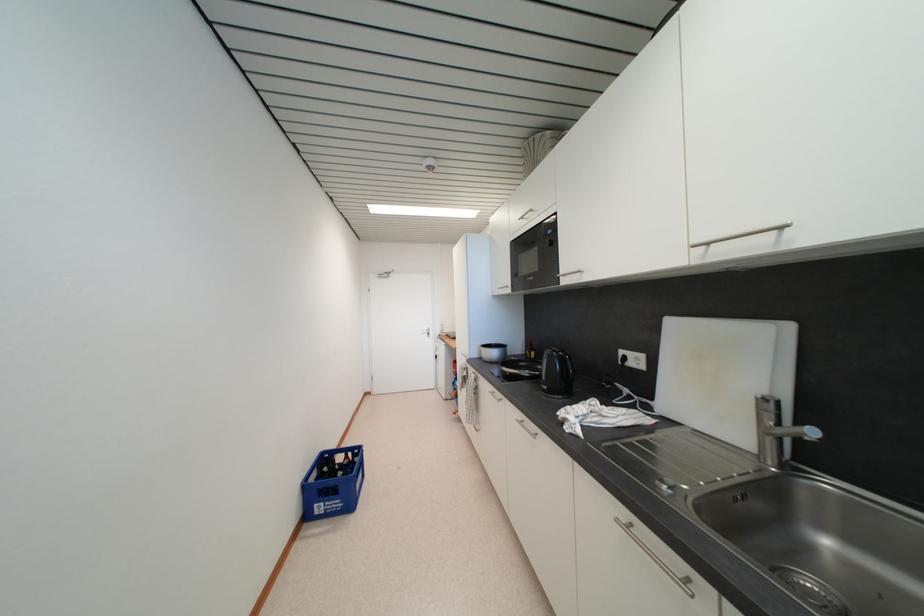
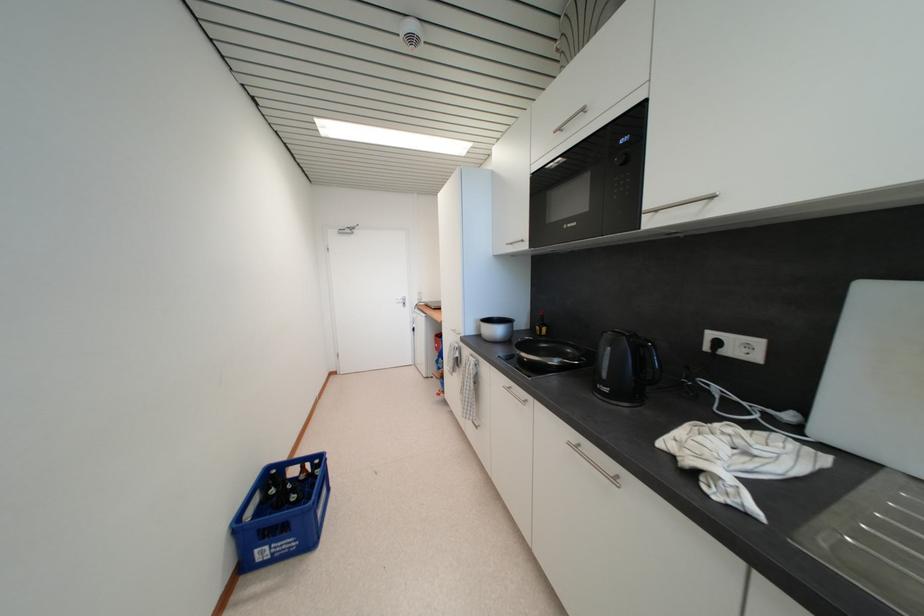
Question: The images are taken continuously from a first-person perspective. In which direction is your viewpoint rotating?

Choices:
 (A) Left
 (B) Right
 (C) Up
 (D) Down

Answer: (D)